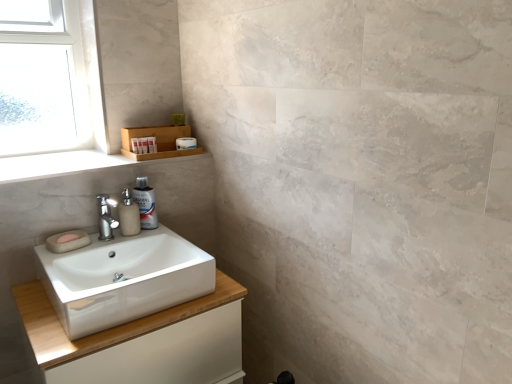
Where is `free space to the left of white matte container at upper left, which is counted as the second toiletry, starting from the back`? This screenshot has height=384, width=512. free space to the left of white matte container at upper left, which is counted as the second toiletry, starting from the back is located at coordinates (86, 157).